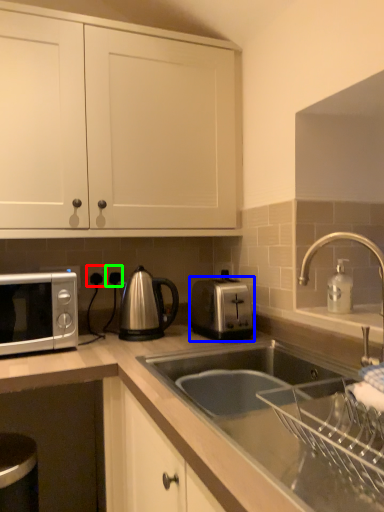
Question: Which object is the farthest from electric outlet (highlighted by a red box)? Choose among these: toaster (highlighted by a blue box) or electric outlet (highlighted by a green box).

Choices:
 (A) toaster
 (B) electric outlet

Answer: (A)